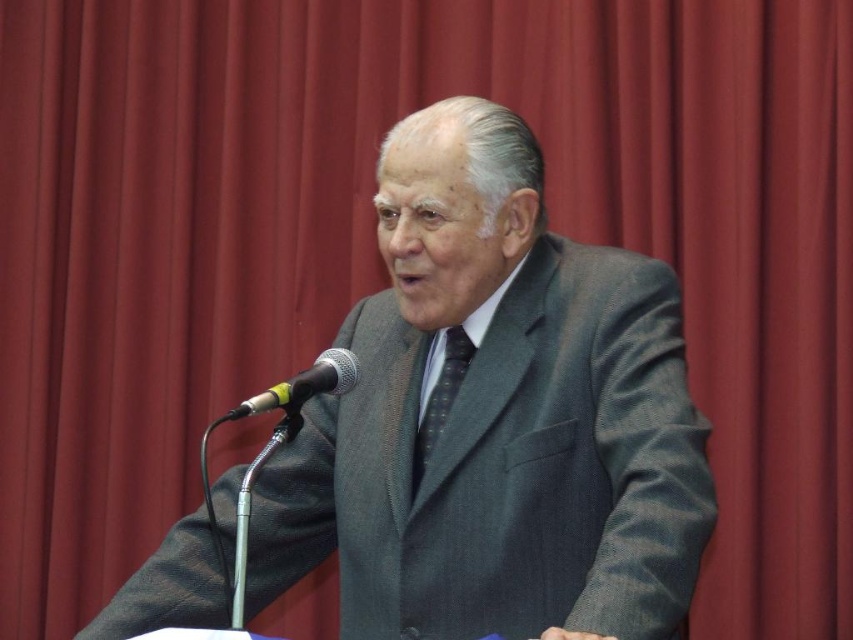
You are an event planner setting up a stage for a speaker. You need to place a new podium so that the microphone is exactly in the center of the stage. The stage is a rectangle with coordinates from 0 to 1 on both axes. Given the current position of the microphone at point (303, 385), how far horizontally and vertically do you need to move it to center it?

The current microphone position is at (303, 385). To center it on the stage, you need to move it to 0.5, 0.5. Therefore, move it horizontally by 0.5000000000000001 minus 0.603 equals approximately 0.097 units to the left and vertically by 0.5 minus 0.356 equals 0.144 units upward.

In the scene shown: You are a photographer setting up for a speech event. You need to ensure that the gray textured suit at center is visible above the silver metallic microphone at center in your photo. Based on the scene description, will this be possible?

The gray textured suit at center has a greater height compared to the silver metallic microphone at center, so yes, the photographer can ensure the gray textured suit at center is visible above the silver metallic microphone at center in the photo.

You are an event organizer who needs to place a small decorative item between the two points, point (289, 536) and point (430, 444). Which point should the item be closer to in order to be closer to the speaker?

The item should be placed closer to point (430, 444) because it is farther from the viewer compared to point (289, 536), making it closer to the speaker who is positioned at the podium.